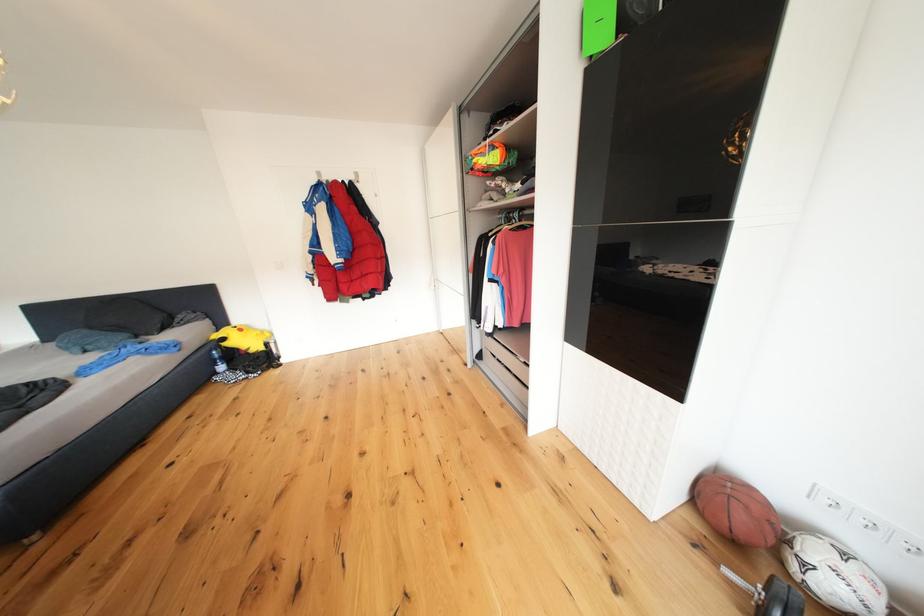
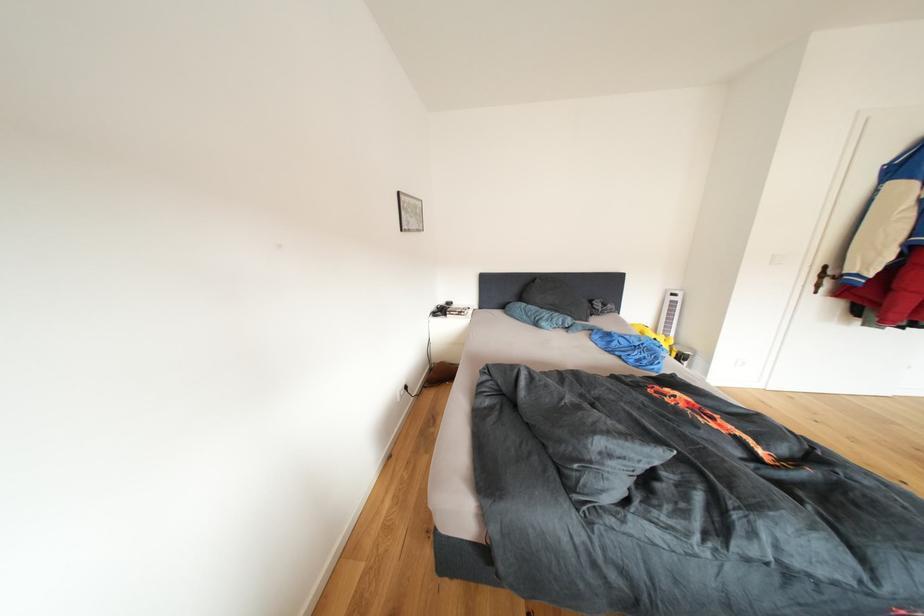
Question: What movement of the cameraman would produce the second image?

Choices:
 (A) Left
 (B) Right
 (C) Forward
 (D) Backward

Answer: (A)